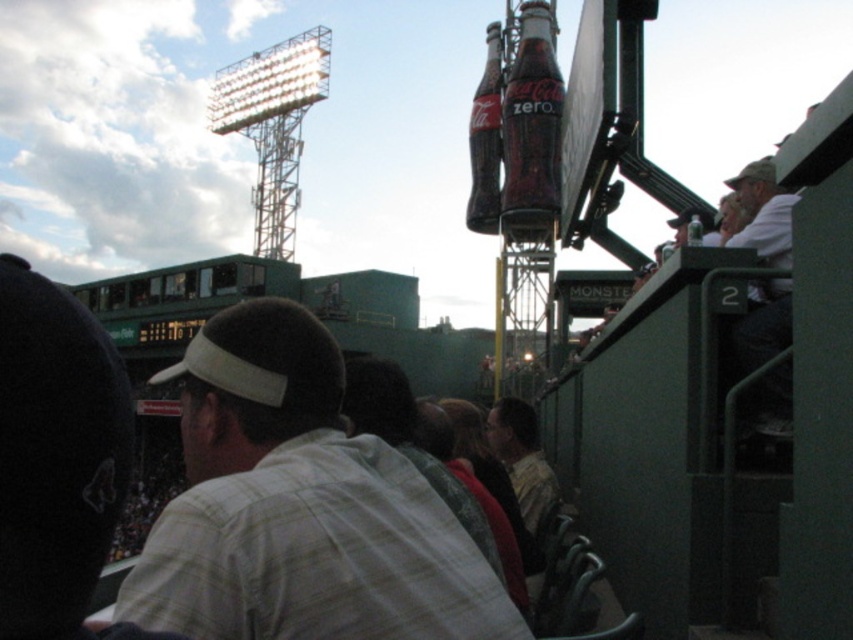
Is translucent glass coca-cola zero at center to the left of translucent glass coca-cola bottle at center from the viewer's perspective?

Incorrect, translucent glass coca-cola zero at center is not on the left side of translucent glass coca-cola bottle at center.

Based on the photo, is translucent glass coca-cola zero at center positioned before translucent glass coca-cola bottle at center?

Yes.

Describe the element at coordinates (531, 129) in the screenshot. I see `translucent glass coca-cola zero at center` at that location.

Find the location of a particular element. translucent glass coca-cola zero at center is located at coordinates click(x=531, y=129).

Can you confirm if white plaid shirt at center is wider than translucent glass coca-cola bottle at center?

Yes.

Which is behind, point (329, 616) or point (498, 193)?

The point (498, 193) is behind.

Does point (425, 596) come in front of point (488, 200)?

That is True.

Where is `white plaid shirt at center`? The height and width of the screenshot is (640, 853). white plaid shirt at center is located at coordinates (299, 508).

Consider the image. Is translucent glass coca-cola zero at center wider than white cotton shirt at right?

Correct, the width of translucent glass coca-cola zero at center exceeds that of white cotton shirt at right.

Does translucent glass coca-cola zero at center appear over white cotton shirt at right?

Indeed, translucent glass coca-cola zero at center is positioned over white cotton shirt at right.

The width and height of the screenshot is (853, 640). What are the coordinates of `translucent glass coca-cola zero at center` in the screenshot? It's located at (531, 129).